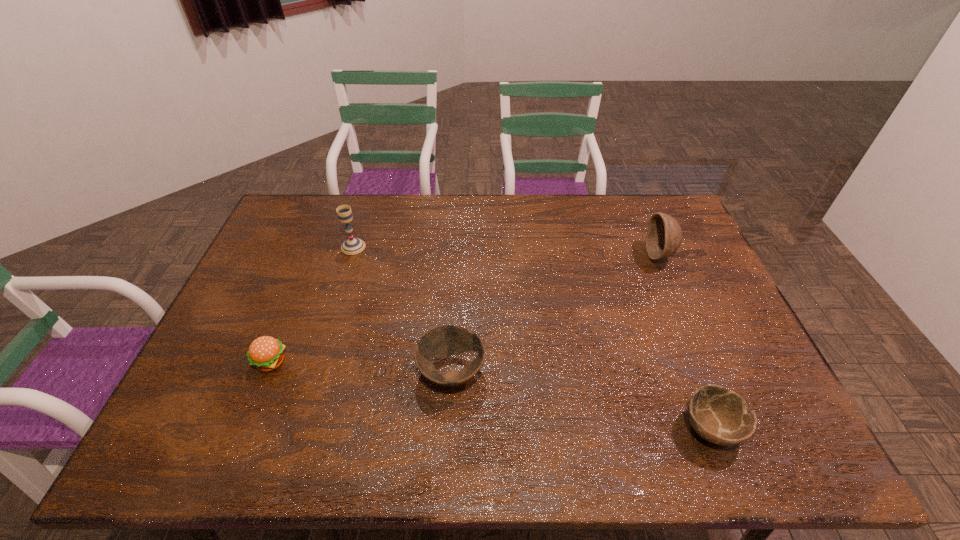
Point out which bowl is positioned as the nearest to the tallest bowl. Please provide its 2D coordinates. Your answer should be formatted as a tuple, i.e. [(x, y)], where the tuple contains the x and y coordinates of a point satisfying the conditions above.

[(720, 416)]

Locate an element on the screen. The height and width of the screenshot is (540, 960). bowl that stands as the second closest to the farthest bowl is located at coordinates (445, 340).

At what (x,y) coordinates should I click in order to perform the action: click on vacant space that satisfies the following two spatial constraints: 1. on the front side of the leftmost bowl; 2. on the right side of the leftmost object. Please return your answer as a coordinate pair (x, y). The width and height of the screenshot is (960, 540). Looking at the image, I should click on (267, 372).

Image resolution: width=960 pixels, height=540 pixels. What are the coordinates of `free space that satisfies the following two spatial constraints: 1. on the front side of the shortest bowl; 2. on the left side of the leftmost bowl` in the screenshot? It's located at (448, 428).

Locate an element on the screen. vacant position in the image that satisfies the following two spatial constraints: 1. on the front side of the shortest bowl; 2. on the left side of the leftmost bowl is located at coordinates (448, 428).